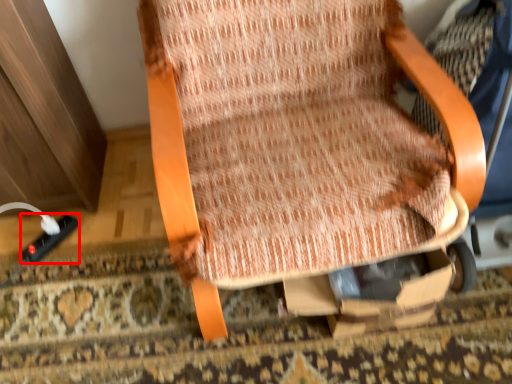
Question: From the image's perspective, what is the correct spatial positioning of plug (annotated by the red box) in reference to chair?

Choices:
 (A) below
 (B) above

Answer: (A)